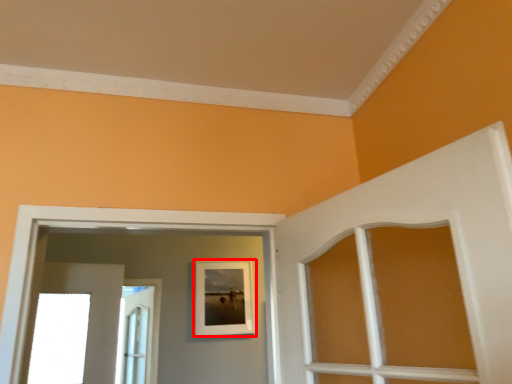
Question: From the image's perspective, where is picture frame (annotated by the red box) located relative to door?

Choices:
 (A) below
 (B) above

Answer: (B)